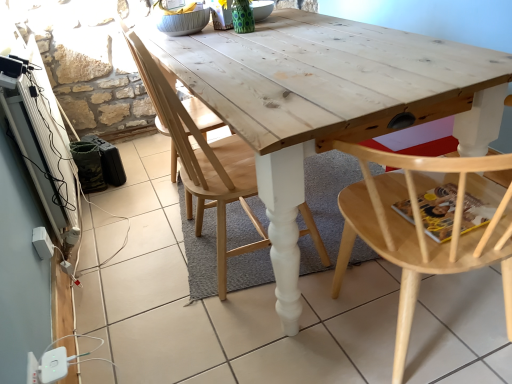
Question: From a real-world perspective, does natural wood table at center sit lower than natural wood chair at center, placed as the first chair when sorted from left to right?

Choices:
 (A) yes
 (B) no

Answer: (A)

Question: Can you confirm if natural wood table at center is positioned to the left of natural wood chair at center, positioned as the 3th chair in right-to-left order?

Choices:
 (A) yes
 (B) no

Answer: (B)

Question: Does natural wood table at center have a lesser height compared to natural wood chair at center, placed as the first chair when sorted from left to right?

Choices:
 (A) yes
 (B) no

Answer: (A)

Question: From the image's perspective, is natural wood table at center below natural wood chair at center, positioned as the 3th chair in right-to-left order?

Choices:
 (A) no
 (B) yes

Answer: (B)

Question: Is natural wood table at center located outside natural wood chair at center, positioned as the 3th chair in right-to-left order?

Choices:
 (A) yes
 (B) no

Answer: (A)

Question: In terms of width, does natural wood chair at center, which ranks as the third chair in left-to-right order, look wider or thinner when compared to natural wood chair at center, which appears as the 2th chair when viewed from the left?

Choices:
 (A) wide
 (B) thin

Answer: (A)

Question: From the image's perspective, relative to natural wood chair at center, which appears as the 2th chair when viewed from the left, is natural wood chair at center, acting as the 1th chair starting from the right, above or below?

Choices:
 (A) below
 (B) above

Answer: (A)

Question: From a real-world perspective, is natural wood chair at center, acting as the 1th chair starting from the right, positioned above or below natural wood chair at center, which appears as the 2th chair when viewed from the left?

Choices:
 (A) below
 (B) above

Answer: (A)

Question: Considering their positions, is natural wood chair at center, acting as the 1th chair starting from the right, located in front of or behind natural wood chair at center, which is the second chair in right-to-left order?

Choices:
 (A) front
 (B) behind

Answer: (A)

Question: Choose the correct answer: Is natural wood chair at center, which is the second chair in right-to-left order, inside natural wood chair at center, acting as the 1th chair starting from the right, or outside it?

Choices:
 (A) inside
 (B) outside

Answer: (B)

Question: Considering the relative positions of natural wood chair at center, which appears as the 2th chair when viewed from the left, and natural wood chair at center, acting as the 1th chair starting from the right, in the image provided, is natural wood chair at center, which appears as the 2th chair when viewed from the left, to the left or to the right of natural wood chair at center, acting as the 1th chair starting from the right,?

Choices:
 (A) right
 (B) left

Answer: (B)

Question: Looking at their shapes, would you say natural wood chair at center, which appears as the 2th chair when viewed from the left, is wider or thinner than natural wood chair at center, acting as the 1th chair starting from the right?

Choices:
 (A) thin
 (B) wide

Answer: (A)

Question: From the image's perspective, is natural wood chair at center, which is the second chair in right-to-left order, located above or below natural wood chair at center, which ranks as the third chair in left-to-right order?

Choices:
 (A) above
 (B) below

Answer: (A)

Question: In the image, is natural wood chair at center, which is the second chair in right-to-left order, positioned in front of or behind natural wood chair at center, positioned as the 3th chair in right-to-left order?

Choices:
 (A) front
 (B) behind

Answer: (A)

Question: Considering the positions of natural wood chair at center, which appears as the 2th chair when viewed from the left, and natural wood chair at center, placed as the first chair when sorted from left to right, in the image, is natural wood chair at center, which appears as the 2th chair when viewed from the left, taller or shorter than natural wood chair at center, placed as the first chair when sorted from left to right,?

Choices:
 (A) short
 (B) tall

Answer: (A)